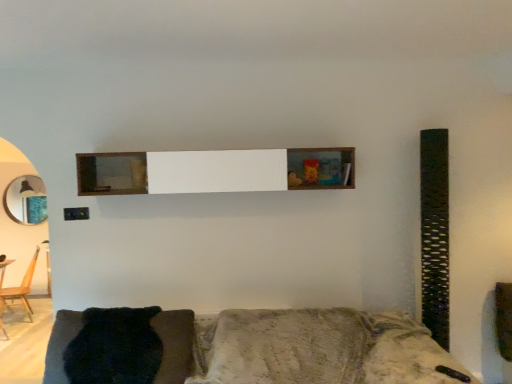
Question: Is wooden chair at left oriented away from dark fuzzy pillow at lower left?

Choices:
 (A) no
 (B) yes

Answer: (A)

Question: Could you tell me if wooden chair at left is facing dark fuzzy pillow at lower left?

Choices:
 (A) no
 (B) yes

Answer: (A)

Question: Does wooden chair at left have a lesser width compared to dark fuzzy pillow at lower left?

Choices:
 (A) no
 (B) yes

Answer: (B)

Question: Considering the relative sizes of wooden chair at left and dark fuzzy pillow at lower left in the image provided, is wooden chair at left shorter than dark fuzzy pillow at lower left?

Choices:
 (A) yes
 (B) no

Answer: (B)

Question: Is wooden chair at left behind dark fuzzy pillow at lower left?

Choices:
 (A) no
 (B) yes

Answer: (B)

Question: Does wooden chair at left have a larger size compared to dark fuzzy pillow at lower left?

Choices:
 (A) no
 (B) yes

Answer: (B)

Question: Is wooden shelf at center inside dark fuzzy pillow at lower left?

Choices:
 (A) yes
 (B) no

Answer: (B)

Question: From a real-world perspective, is dark fuzzy pillow at lower left located higher than wooden shelf at center?

Choices:
 (A) yes
 (B) no

Answer: (B)

Question: Is dark fuzzy pillow at lower left positioned before wooden shelf at center?

Choices:
 (A) yes
 (B) no

Answer: (A)

Question: Does dark fuzzy pillow at lower left have a larger size compared to wooden shelf at center?

Choices:
 (A) no
 (B) yes

Answer: (A)

Question: Considering the relative positions of dark fuzzy pillow at lower left and wooden shelf at center in the image provided, is dark fuzzy pillow at lower left to the left of wooden shelf at center from the viewer's perspective?

Choices:
 (A) yes
 (B) no

Answer: (A)

Question: Is dark fuzzy pillow at lower left facing towards wooden shelf at center?

Choices:
 (A) no
 (B) yes

Answer: (A)

Question: Is textured gray couch at lower center bigger than wooden table at lower left?

Choices:
 (A) yes
 (B) no

Answer: (A)